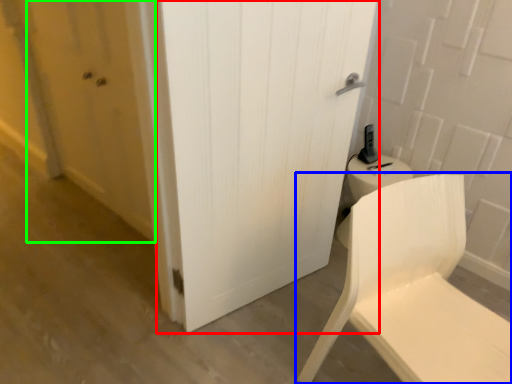
Question: Which is farther away from door (highlighted by a red box)? chair (highlighted by a blue box) or screen door (highlighted by a green box)?

Choices:
 (A) chair
 (B) screen door

Answer: (B)